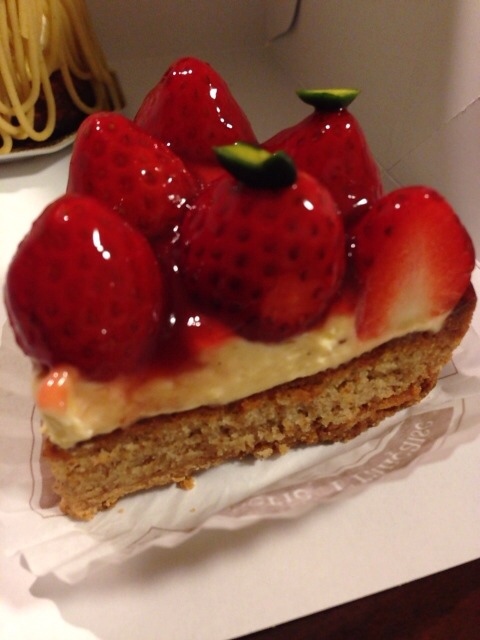
Locate an element on the screen. This screenshot has width=480, height=640. white surface is located at coordinates (423, 556).